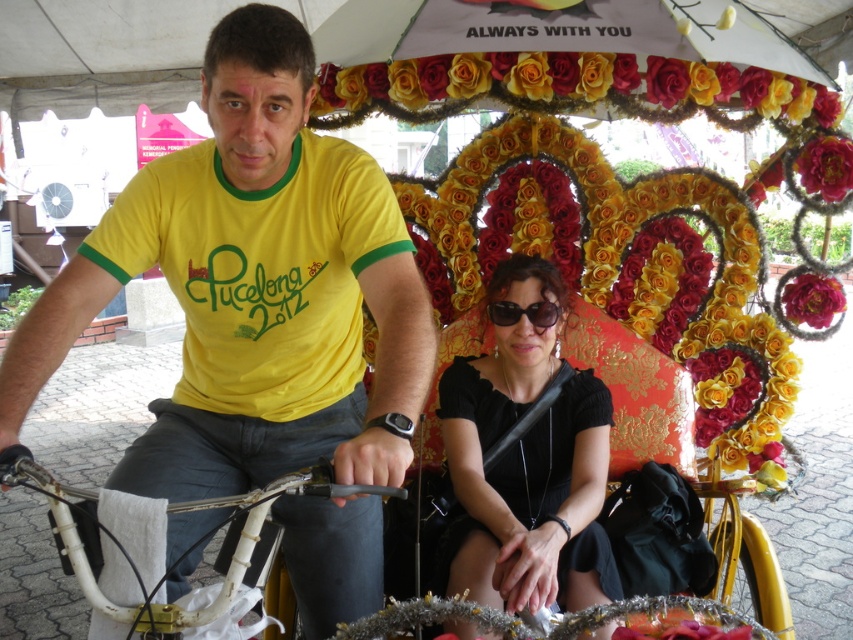
Question: Considering the real-world distances, which object is farthest from the yellow fabric flowers at upper center?

Choices:
 (A) deep red silk flower at upper right
 (B) black matte dress at center
 (C) black plastic sunglasses at center
 (D) deep red silk flower at center

Answer: (B)

Question: Which point appears closest to the camera in this image?

Choices:
 (A) (180, 627)
 (B) (216, 120)
 (C) (817, 323)

Answer: (A)

Question: Which object is closer to the camera taking this photo?

Choices:
 (A) white matte bicycle handlebars at left
 (B) yellow fabric flowers at upper center
 (C) black plastic sunglasses at center
 (D) black matte dress at center

Answer: (A)

Question: Is yellow matte shirt at center above black matte dress at center?

Choices:
 (A) no
 (B) yes

Answer: (B)

Question: Is yellow matte shirt at center to the left of deep red silk flower at center from the viewer's perspective?

Choices:
 (A) yes
 (B) no

Answer: (A)

Question: Is yellow matte shirt at center bigger than black matte dress at center?

Choices:
 (A) no
 (B) yes

Answer: (B)